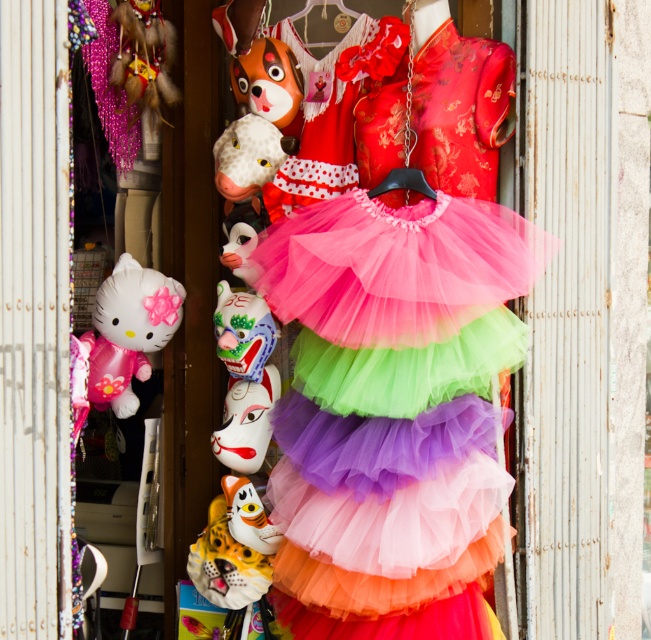
Question: Which point is farther to the camera?

Choices:
 (A) click(x=281, y=42)
 (B) click(x=219, y=458)
 (C) click(x=128, y=321)
 (D) click(x=238, y=348)

Answer: (A)

Question: Can you confirm if matte white mask at center is smaller than porcelain painted mask at center?

Choices:
 (A) no
 (B) yes

Answer: (A)

Question: Is matte orange mask at upper center above matte yellow plush toy at center?

Choices:
 (A) no
 (B) yes

Answer: (B)

Question: Which point is farther to the camera?

Choices:
 (A) (232, 504)
 (B) (260, 138)

Answer: (A)

Question: Among these points, which one is farthest from the camera?

Choices:
 (A) (284, 83)
 (B) (238, 381)

Answer: (B)

Question: Where is matte white mask at center located in relation to porcelain painted mask at center in the image?

Choices:
 (A) left
 (B) right

Answer: (A)